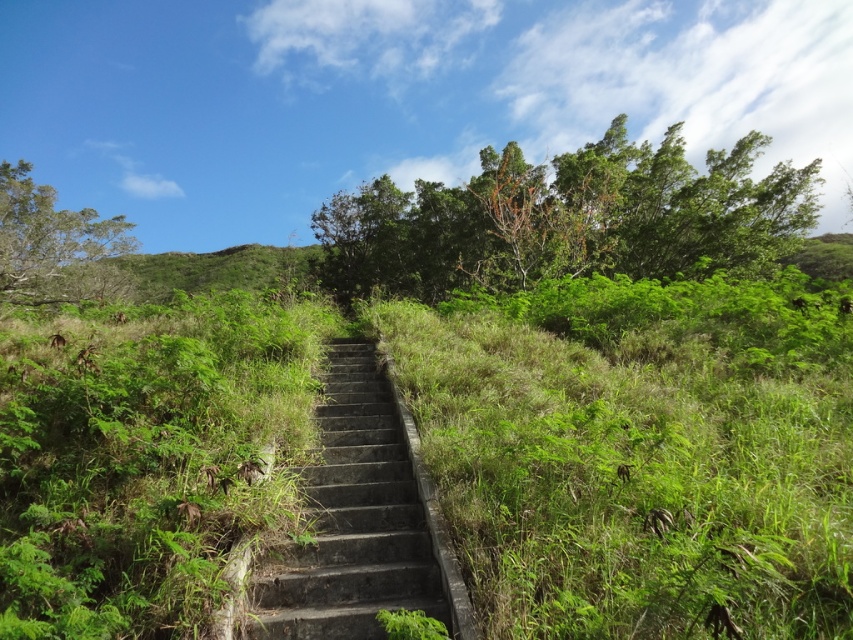
Question: Does green leafy bush at upper center appear under dark gray concrete stairs at center?

Choices:
 (A) yes
 (B) no

Answer: (B)

Question: Among these points, which one is farthest from the camera?

Choices:
 (A) (627, 492)
 (B) (372, 593)

Answer: (B)

Question: Which object appears closest to the camera in this image?

Choices:
 (A) green leafy bush at upper center
 (B) green grassy at center

Answer: (B)

Question: Which of the following is the closest to the observer?

Choices:
 (A) (444, 624)
 (B) (521, 540)
 (C) (379, 202)

Answer: (A)

Question: Can you confirm if green grassy at center is positioned to the left of green leafy bush at upper center?

Choices:
 (A) no
 (B) yes

Answer: (B)

Question: Is green leafy bush at upper center positioned at the back of dark gray concrete stairs at center?

Choices:
 (A) no
 (B) yes

Answer: (B)